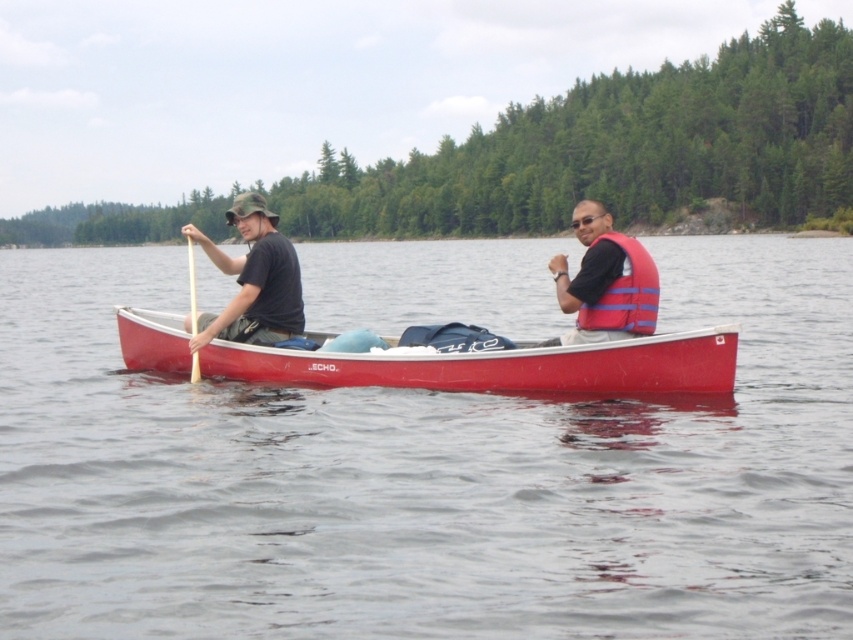
What are the coordinates of `red plastic canoe at center` in the screenshot? It's located at (503, 365).

Between point (178, 364) and point (264, 240), which one is positioned in front?

Point (264, 240) is in front.

Where is `red plastic canoe at center`? This screenshot has width=853, height=640. red plastic canoe at center is located at coordinates (503, 365).

Does transparent water at center have a greater height compared to red plastic canoe at center?

Correct, transparent water at center is much taller as red plastic canoe at center.

Does transparent water at center appear under red plastic canoe at center?

No.

Image resolution: width=853 pixels, height=640 pixels. What do you see at coordinates (426, 476) in the screenshot?
I see `transparent water at center` at bounding box center [426, 476].

Locate an element on the screen. The width and height of the screenshot is (853, 640). transparent water at center is located at coordinates (426, 476).

Is point (193, 228) positioned before point (193, 332)?

No, (193, 228) is further to viewer.

Can you confirm if matte black shirt at left is positioned below wooden paddle at center?

Indeed, matte black shirt at left is positioned under wooden paddle at center.

Identify the location of matte black shirt at left. The image size is (853, 640). (253, 280).

What are the coordinates of `matte black shirt at left` in the screenshot? It's located at (253, 280).